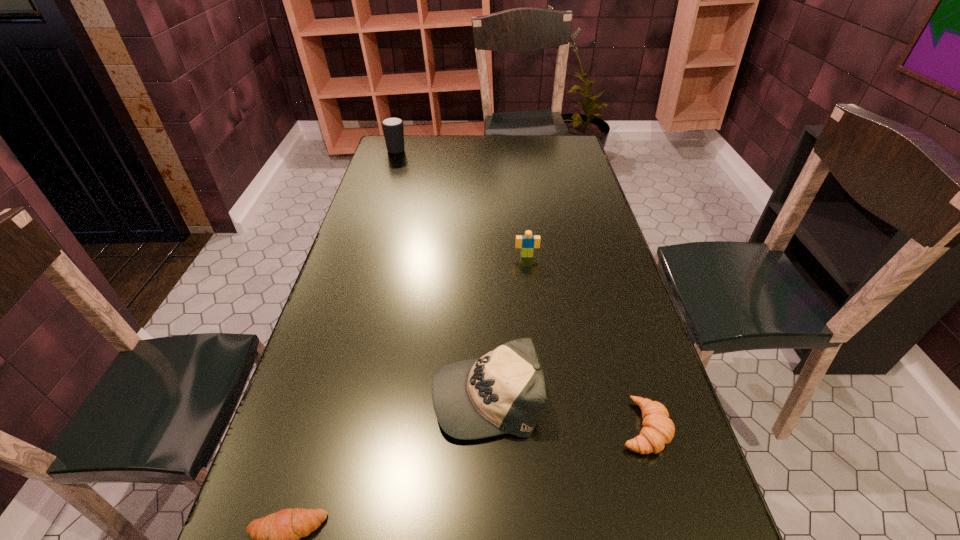
At what (x,y) coordinates should I click in order to perform the action: click on vacant area that lies between the Lego and the baseball cap. Please return your answer as a coordinate pair (x, y). Looking at the image, I should click on (507, 325).

Find the location of a particular element. vacant space that's between the Lego and the farther crescent roll is located at coordinates (585, 341).

The width and height of the screenshot is (960, 540). In order to click on free area in between the right crescent roll and the Lego in this screenshot , I will do (585, 341).

The image size is (960, 540). Find the location of `vacant space that is in between the Lego and the rightmost object`. vacant space that is in between the Lego and the rightmost object is located at coordinates (585, 341).

At what (x,y) coordinates should I click in order to perform the action: click on vacant space that is in between the baseball cap and the Lego. Please return your answer as a coordinate pair (x, y). The height and width of the screenshot is (540, 960). Looking at the image, I should click on (507, 325).

Find the location of a particular element. This screenshot has height=540, width=960. the second closest object relative to the mug is located at coordinates (504, 392).

Locate which object ranks third in proximity to the second farthest object. Please provide its 2D coordinates. Your answer should be formatted as a tuple, i.e. [(x, y)], where the tuple contains the x and y coordinates of a point satisfying the conditions above.

[(393, 129)]

This screenshot has height=540, width=960. In order to click on vacant point that satisfies the following two spatial constraints: 1. on the front-facing side of the baseball cap; 2. on the right side of the taller crescent roll in this screenshot , I will do `click(487, 427)`.

At what (x,y) coordinates should I click in order to perform the action: click on vacant space that satisfies the following two spatial constraints: 1. on the face of the Lego; 2. on the front-facing side of the baseball cap. Please return your answer as a coordinate pair (x, y). Looking at the image, I should click on (543, 394).

The height and width of the screenshot is (540, 960). I want to click on free space that satisfies the following two spatial constraints: 1. on the front-facing side of the baseball cap; 2. on the right side of the rightmost object, so click(x=487, y=427).